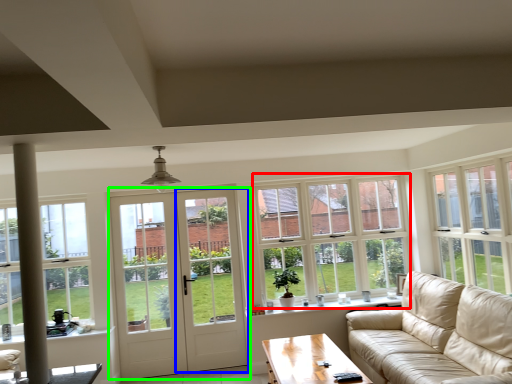
Question: Which object is the farthest from window (highlighted by a red box)? Choose among these: screen door (highlighted by a blue box) or door (highlighted by a green box).

Choices:
 (A) screen door
 (B) door

Answer: (B)